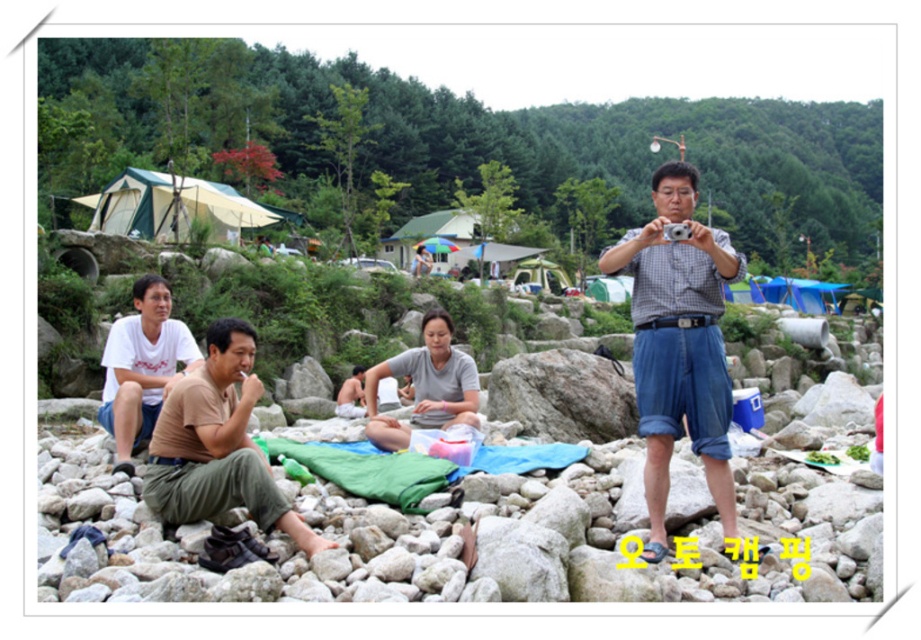
Question: Does brown cotton shirt at lower left appear over white cotton shirt at left?

Choices:
 (A) no
 (B) yes

Answer: (A)

Question: Which point is closer to the camera taking this photo?

Choices:
 (A) (647, 444)
 (B) (234, 356)

Answer: (A)

Question: Does brown cotton shirt at lower left appear on the right side of white cotton shirt at left?

Choices:
 (A) yes
 (B) no

Answer: (A)

Question: Which point is farther to the camera?

Choices:
 (A) brown cotton shirt at lower left
 (B) checkered fabric shirt at center

Answer: (B)

Question: Which object is closer to the camera taking this photo?

Choices:
 (A) brown cotton shirt at lower left
 (B) white cotton shirt at left
 (C) checkered fabric shirt at center

Answer: (A)

Question: Does checkered fabric shirt at center have a greater width compared to brown cotton shirt at lower left?

Choices:
 (A) yes
 (B) no

Answer: (B)